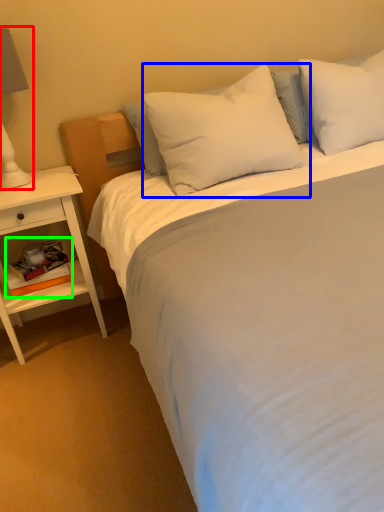
Question: Estimate the real-world distances between objects in this image. Which object is farther from bedside lamp (highlighted by a red box), pillow (highlighted by a blue box) or book (highlighted by a green box)?

Choices:
 (A) pillow
 (B) book

Answer: (A)